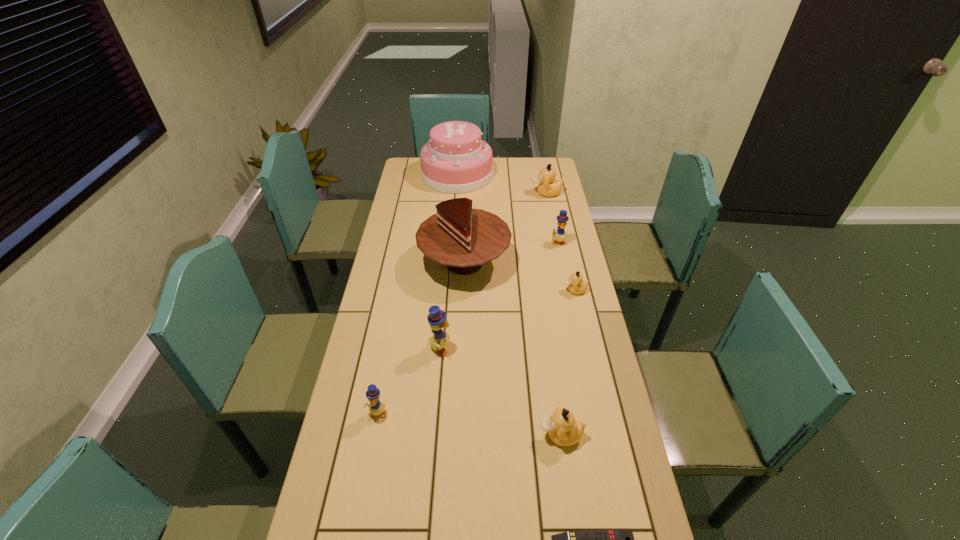
Where is `free space located on the face of the second farthest duckling, where the monocle is placed`? free space located on the face of the second farthest duckling, where the monocle is placed is located at coordinates (570, 299).

Where is `vacant position located on the face of the nearest tan duckling`? This screenshot has width=960, height=540. vacant position located on the face of the nearest tan duckling is located at coordinates tap(483, 435).

Find the location of a particular element. Image resolution: width=960 pixels, height=540 pixels. vacant space located 0.060m on the face of the nearest tan duckling is located at coordinates (516, 435).

Locate an element on the screen. free region located on the face of the nearest tan duckling is located at coordinates (483, 435).

Locate an element on the screen. free location located 0.290m on the face of the leftmost yellow duckling, where the monocle is placed is located at coordinates (354, 537).

You are a GUI agent. You are given a task and a screenshot of the screen. Output one action in this format:
    pyautogui.click(x=<x>, y=<y>)
    Task: Click on the vacant space located on the face of the fourth nearest duckling
    
    Given the screenshot: What is the action you would take?
    pyautogui.click(x=462, y=291)

Locate an element on the screen. free space located 0.260m on the face of the fourth nearest duckling is located at coordinates (490, 291).

This screenshot has height=540, width=960. Identify the location of vacant area situated on the face of the fourth nearest duckling. (507, 291).

Locate an element on the screen. This screenshot has height=540, width=960. object at the far edge is located at coordinates (455, 160).

Where is `birthday cake that is at the left edge`? The width and height of the screenshot is (960, 540). birthday cake that is at the left edge is located at coordinates (455, 160).